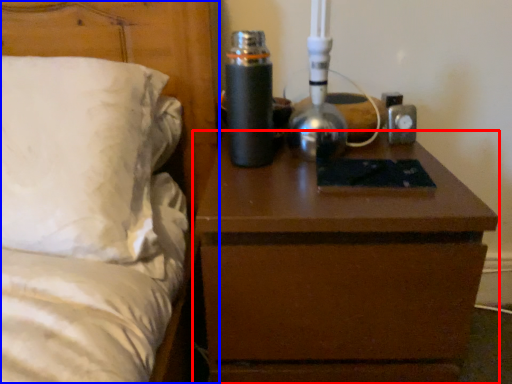
Question: Which point is closer to the camera, nightstand (highlighted by a red box) or bed (highlighted by a blue box)?

Choices:
 (A) nightstand
 (B) bed

Answer: (B)